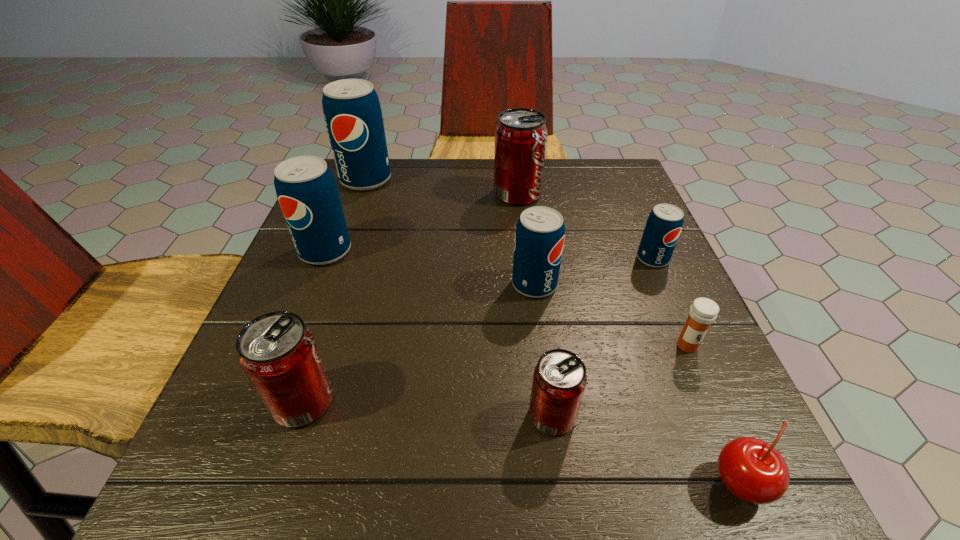
Locate an element on the screen. The width and height of the screenshot is (960, 540). the sixth farthest object is located at coordinates coord(703,312).

The height and width of the screenshot is (540, 960). I want to click on the nearest object, so click(x=751, y=469).

This screenshot has width=960, height=540. Identify the location of free space located on the front of the biggest blue pop. (321, 306).

You are a GUI agent. You are given a task and a screenshot of the screen. Output one action in this format:
    pyautogui.click(x=<x>, y=<y>)
    Task: Click on the vacant space located on the left of the farthest red pop soda
    
    Given the screenshot: What is the action you would take?
    click(x=338, y=194)

At what (x,y) coordinates should I click in order to perform the action: click on free spot located on the front of the third smallest blue pop. Please return your answer as a coordinate pair (x, y). Looking at the image, I should click on (291, 339).

You are a GUI agent. You are given a task and a screenshot of the screen. Output one action in this format:
    pyautogui.click(x=<x>, y=<y>)
    Task: Click on the vacant space located on the left of the second blue pop from right to left
    The width and height of the screenshot is (960, 540).
    Given the screenshot: What is the action you would take?
    pyautogui.click(x=408, y=285)

Identify the location of free region located 0.050m on the left of the leftmost red pop soda. (239, 402).

The width and height of the screenshot is (960, 540). What are the coordinates of `vacant space positioned on the front of the rightmost pop soda` in the screenshot? It's located at (732, 441).

Where is `free space located on the back of the smallest red pop soda`? Image resolution: width=960 pixels, height=540 pixels. free space located on the back of the smallest red pop soda is located at coordinates point(545,362).

The width and height of the screenshot is (960, 540). Find the location of `free spot located on the label side of the medicine`. free spot located on the label side of the medicine is located at coordinates (726, 435).